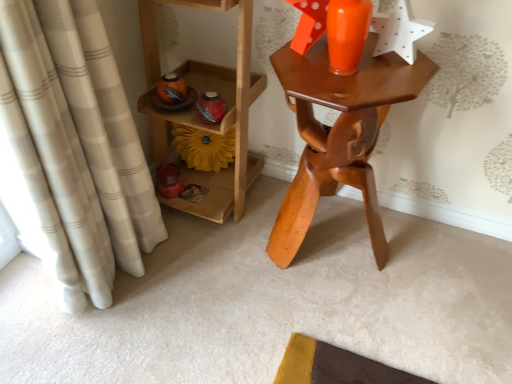
Locate an element on the screen. vacant region below beige plaid curtain at left (from a real-world perspective) is located at coordinates (137, 272).